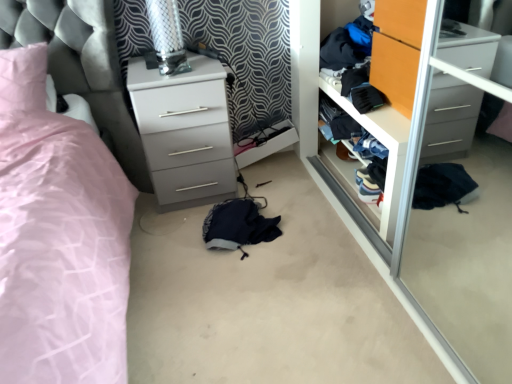
Find the location of `vacant space in between white glossy chest of drawers at center and wooden closet door at center`. vacant space in between white glossy chest of drawers at center and wooden closet door at center is located at coordinates (296, 195).